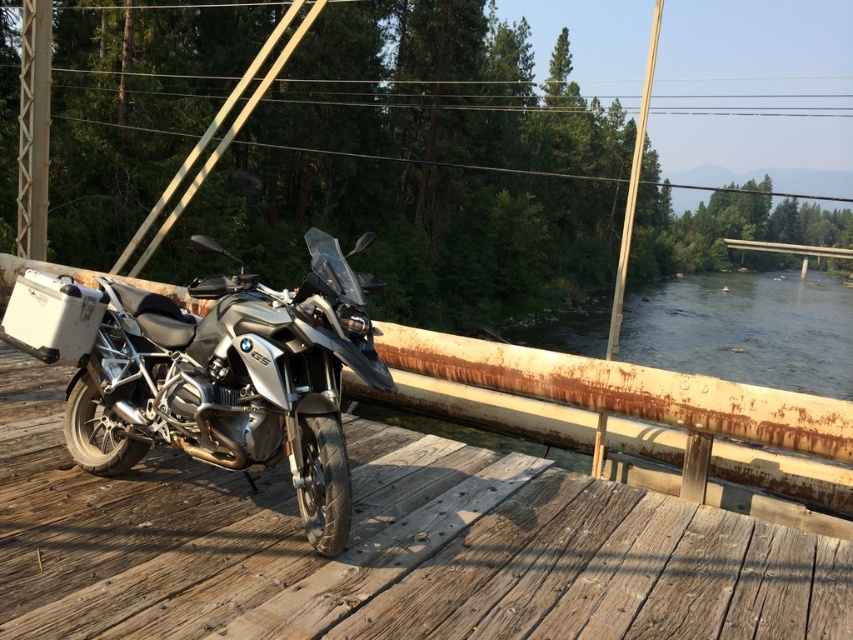
You are standing on the wooden deck at center and want to walk towards the silver metallic motorcycle at center. Which direction should you move to get closer to the motorcycle?

Since the wooden deck at center is closer to the viewer than the silver metallic motorcycle at center, you should move backward away from the wooden deck at center to get closer to the motorcycle.

You are a delivery person trying to park your motorcycle on the wooden bridge. The motorcycle you are riding is the same size as the silver metallic motorcycle at center. There is a brushed metal pole at upper left nearby. If you want to park your motorcycle without touching the pole, how much space should you leave between them?

The silver metallic motorcycle at center is wider than the brushed metal pole at upper left. To park without touching, the motorcycle should be positioned so there is enough space between them, considering the motorcycle is wider. However, exact measurements aren